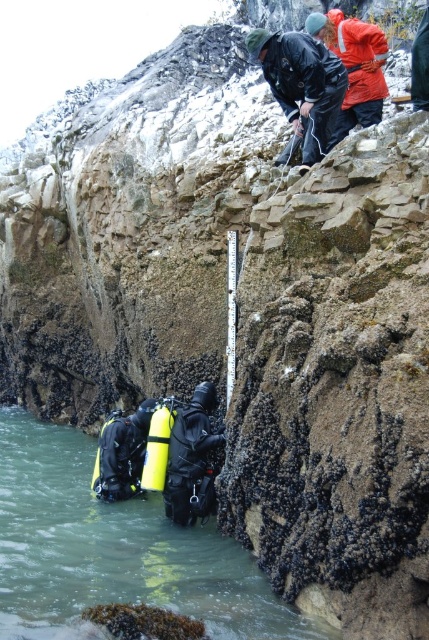
Is orange waterproof jacket at upper right smaller than yellow matte scuba tank at lower center?

No, orange waterproof jacket at upper right is not smaller than yellow matte scuba tank at lower center.

Who is positioned more to the right, orange waterproof jacket at upper right or yellow matte scuba tank at lower center?

orange waterproof jacket at upper right is more to the right.

Which is in front, point (356, 42) or point (157, 458)?

Positioned in front is point (157, 458).

Locate an element on the screen. The height and width of the screenshot is (640, 429). orange waterproof jacket at upper right is located at coordinates (355, 65).

Between point (301, 72) and point (157, 458), which one is positioned behind?

The point (157, 458) is behind.

Identify the location of black matte jacket at center. coord(302,88).

Can you confirm if green matte water at lower left is bigger than yellow matte scuba tank at lower center?

Yes.

Is green matte water at lower left below yellow matte scuba tank at lower center?

Yes, green matte water at lower left is below yellow matte scuba tank at lower center.

Does point (3, 426) come behind point (151, 468)?

Yes, it is.

You are a GUI agent. You are given a task and a screenshot of the screen. Output one action in this format:
    pyautogui.click(x=<x>, y=<y>)
    Task: Click on the green matte water at lower left
    
    Given the screenshot: What is the action you would take?
    pyautogui.click(x=114, y=550)